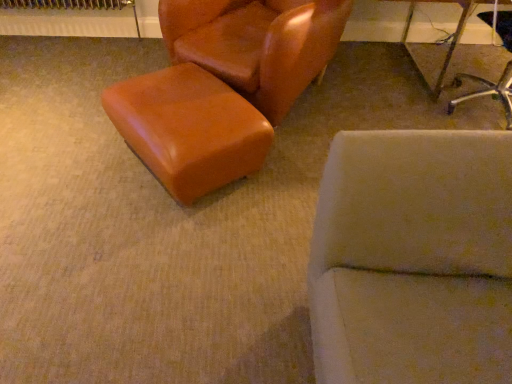
Question: In terms of height, does metallic silver chair at upper right, marked as the second chair in a left-to-right arrangement, look taller or shorter compared to leather-like brown chair at upper left, which is the second chair in right-to-left order?

Choices:
 (A) short
 (B) tall

Answer: (A)

Question: Relative to leather-like brown chair at upper left, which is the second chair in right-to-left order, is metallic silver chair at upper right, which is the first chair in right-to-left order, in front or behind?

Choices:
 (A) front
 (B) behind

Answer: (B)

Question: Which object is the farthest from the metallic silver chair at upper right, marked as the second chair in a left-to-right arrangement?

Choices:
 (A) leather-like brown chair at upper left, which is the second chair in right-to-left order
 (B) satin brown ottoman at center

Answer: (B)

Question: Which is farther from the satin brown ottoman at center?

Choices:
 (A) leather-like brown chair at upper left, which is the second chair in right-to-left order
 (B) metallic silver chair at upper right, which is the first chair in right-to-left order

Answer: (B)